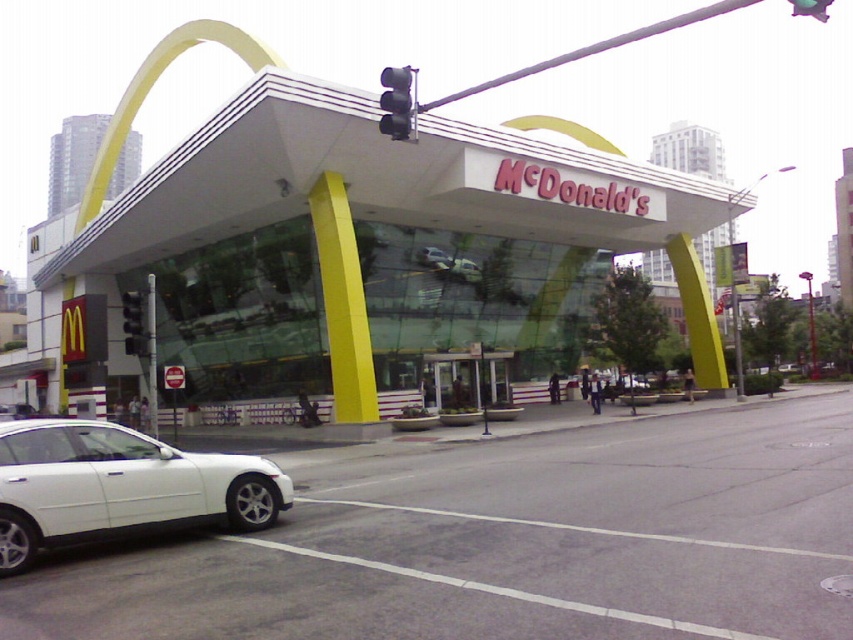
In the scene shown: You are a delivery driver who needs to park your car next to the white matte sedan at lower left. The parking space is only 2 meters wide. Can your car, which is 1.8 meters wide, fit into the space without touching the black plastic traffic light at upper center?

The white matte sedan at lower left has a smaller size compared to the black plastic traffic light at upper center. Since your car is 1.8 meters wide and the parking space is 2 meters wide, there should be enough space for your car to fit without touching the traffic light.